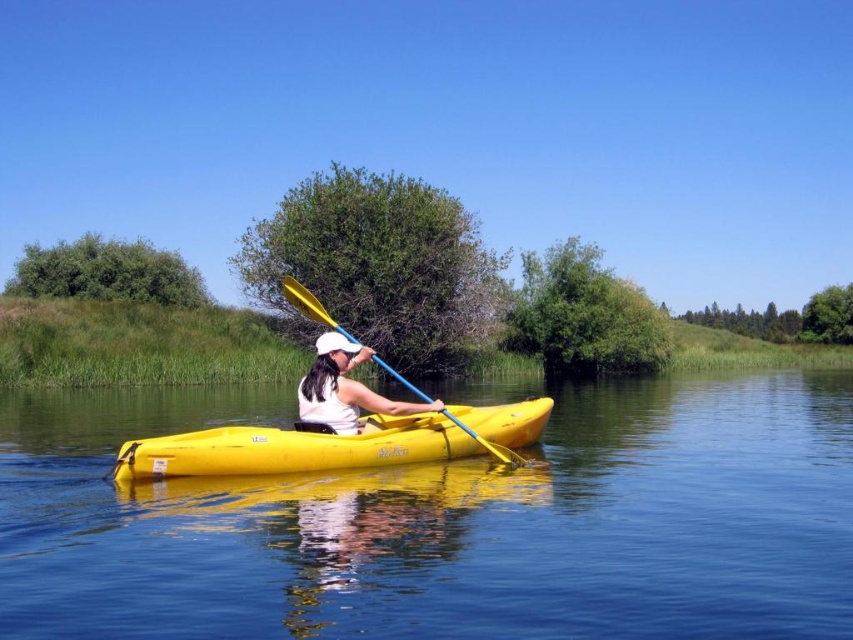
Locate an element on the screen. The height and width of the screenshot is (640, 853). yellow plastic kayak at center is located at coordinates (445, 522).

Is yellow plastic kayak at center closer to the viewer compared to yellow matte kayak at center?

Yes, yellow plastic kayak at center is closer to the viewer.

Is point (740, 410) closer to viewer compared to point (123, 461)?

No, it is behind (123, 461).

Image resolution: width=853 pixels, height=640 pixels. In order to click on yellow plastic kayak at center in this screenshot , I will do `click(445, 522)`.

The width and height of the screenshot is (853, 640). In order to click on yellow matte kayak at center in this screenshot , I will do `click(293, 449)`.

Between point (173, 444) and point (315, 298), which one is positioned behind?

Positioned behind is point (315, 298).

At what (x,y) coordinates should I click in order to perform the action: click on yellow matte kayak at center. Please return your answer as a coordinate pair (x, y). Looking at the image, I should click on (293, 449).

Which is behind, point (325, 394) or point (480, 436)?

Positioned behind is point (480, 436).

Between white matte visor at center and yellow plastic paddle at center, which one has less height?

white matte visor at center

Where is `white matte visor at center`? The height and width of the screenshot is (640, 853). white matte visor at center is located at coordinates (345, 388).

This screenshot has width=853, height=640. I want to click on white matte visor at center, so click(345, 388).